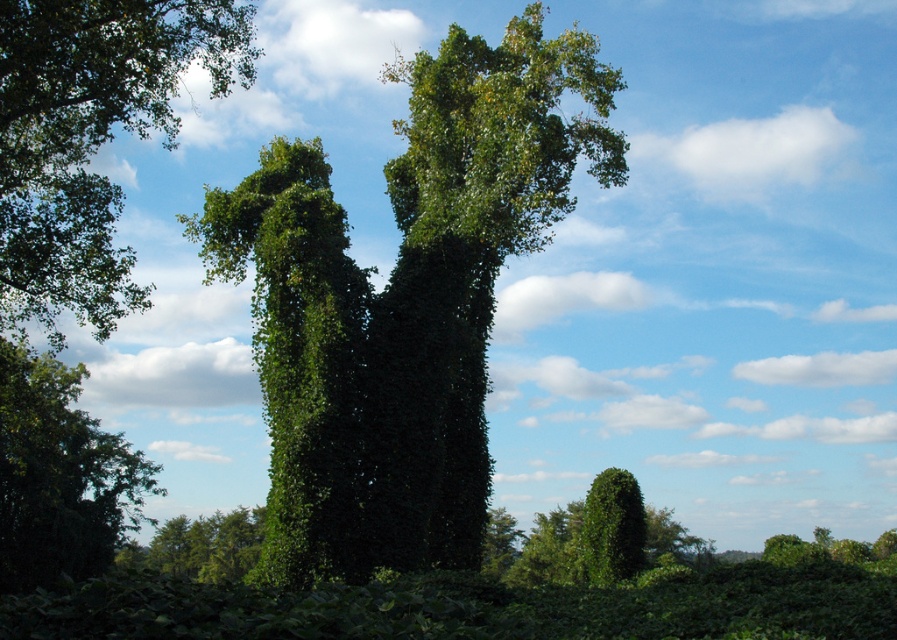
You are standing in the middle of the scene and want to take a photo of both the green leafy tree at upper left and the green leafy bush at lower left. Which one should you focus on first to ensure both are in clear view?

You should focus on the green leafy tree at upper left first because it is closer to you than the green leafy bush at lower left, so adjusting focus from near to far will help both be in clear view.

Looking at this image, looking at the natural landscape with the two green structures, which object is taller between the green leafy tree at upper left and the green leafy bush at lower left?

The green leafy tree at upper left is taller than the green leafy bush at lower left according to the description.

You are standing in the natural landscape and want to take a photo of both the green leafy tree at center and the green leafy tree at upper left. Which direction should you face to ensure both are in your camera frame?

You should face towards the right side of the green leafy tree at upper left to include both the green leafy tree at center and the green leafy tree at upper left in your camera frame since the green leafy tree at center is positioned to the right of the green leafy tree at upper left.